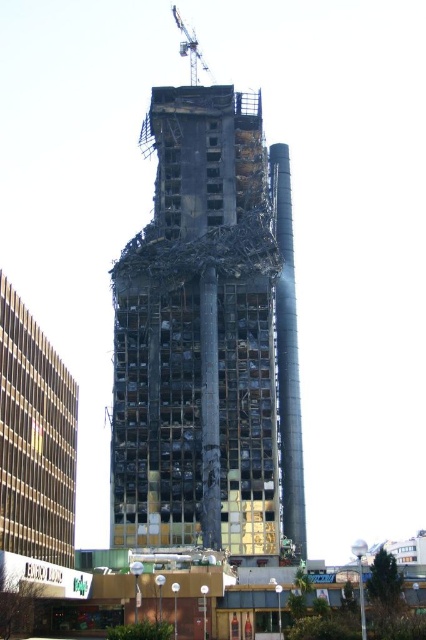
Who is higher up, charcoal concrete tower at center or metallic gray crane at upper center?

metallic gray crane at upper center

Which is behind, point (173, 280) or point (187, 49)?

The point (187, 49) is behind.

This screenshot has width=426, height=640. Find the location of `charcoal concrete tower at center`. charcoal concrete tower at center is located at coordinates (209, 339).